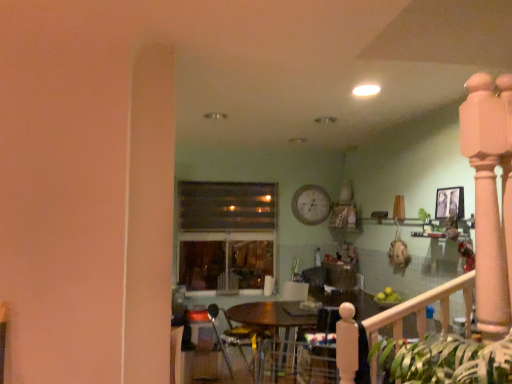
Question: From the image's perspective, is velvet dark blue armchair at center, the second armchair positioned from the left, located above white wooden clock at upper center?

Choices:
 (A) yes
 (B) no

Answer: (B)

Question: From a real-world perspective, is velvet dark blue armchair at center, the second armchair positioned from the left, located higher than white wooden clock at upper center?

Choices:
 (A) yes
 (B) no

Answer: (B)

Question: Considering the relative positions of velvet dark blue armchair at center, the second armchair positioned from the left, and white wooden clock at upper center in the image provided, is velvet dark blue armchair at center, the second armchair positioned from the left, behind white wooden clock at upper center?

Choices:
 (A) yes
 (B) no

Answer: (B)

Question: From the image's perspective, is velvet dark blue armchair at center, the second armchair positioned from the left, below white wooden clock at upper center?

Choices:
 (A) yes
 (B) no

Answer: (A)

Question: Can you confirm if velvet dark blue armchair at center, the second armchair positioned from the left, is shorter than white wooden clock at upper center?

Choices:
 (A) yes
 (B) no

Answer: (B)

Question: Looking at their shapes, would you say wooden table at center is wider or thinner than velvet dark blue armchair at center, the first armchair when ordered from right to left?

Choices:
 (A) wide
 (B) thin

Answer: (A)

Question: Considering the positions of point (472, 283) and point (321, 380), is point (472, 283) closer or farther from the camera than point (321, 380)?

Choices:
 (A) farther
 (B) closer

Answer: (B)

Question: Is wooden table at center inside or outside of velvet dark blue armchair at center, the second armchair positioned from the left?

Choices:
 (A) inside
 (B) outside

Answer: (B)

Question: Relative to velvet dark blue armchair at center, the second armchair positioned from the left, is wooden table at center in front or behind?

Choices:
 (A) behind
 (B) front

Answer: (A)

Question: From a real-world perspective, is transparent glass window at center positioned above or below velvet dark blue armchair at center, the first armchair when ordered from right to left?

Choices:
 (A) below
 (B) above

Answer: (B)

Question: Based on their sizes in the image, would you say transparent glass window at center is bigger or smaller than velvet dark blue armchair at center, the first armchair when ordered from right to left?

Choices:
 (A) small
 (B) big

Answer: (B)

Question: Is transparent glass window at center spatially inside velvet dark blue armchair at center, the second armchair positioned from the left, or outside of it?

Choices:
 (A) outside
 (B) inside

Answer: (A)

Question: Considering the positions of transparent glass window at center and velvet dark blue armchair at center, the first armchair when ordered from right to left, in the image, is transparent glass window at center taller or shorter than velvet dark blue armchair at center, the first armchair when ordered from right to left,?

Choices:
 (A) tall
 (B) short

Answer: (A)

Question: In terms of width, does velvet dark blue armchair at center, the second armchair positioned from the left, look wider or thinner when compared to wooden table at center?

Choices:
 (A) wide
 (B) thin

Answer: (B)

Question: From a real-world perspective, is velvet dark blue armchair at center, the first armchair when ordered from right to left, above or below wooden table at center?

Choices:
 (A) below
 (B) above

Answer: (B)